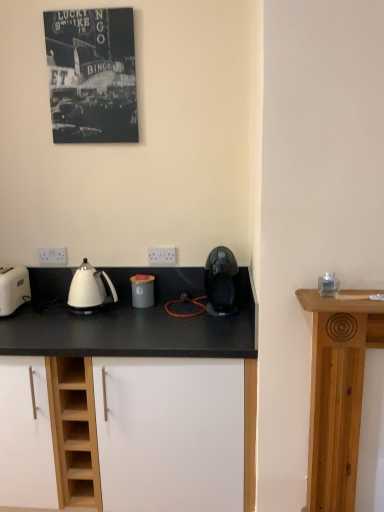
The width and height of the screenshot is (384, 512). What are the coordinates of `vacant space situated above white matte cabinet at center (from a real-world perspective)` in the screenshot? It's located at (111, 313).